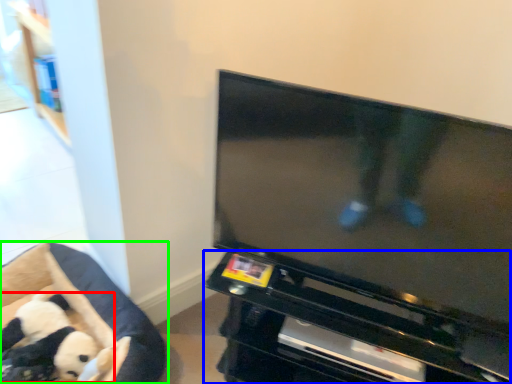
Question: Which object is the closest to the toy (highlighted by a red box)? Choose among these: entertainment center (highlighted by a blue box) or furniture (highlighted by a green box).

Choices:
 (A) entertainment center
 (B) furniture

Answer: (B)